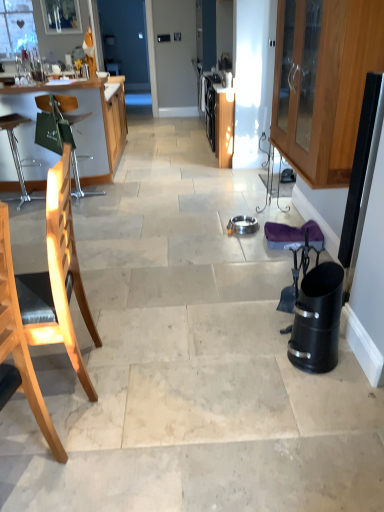
The height and width of the screenshot is (512, 384). What do you see at coordinates (323, 82) in the screenshot?
I see `wooden cabinet at right` at bounding box center [323, 82].

The image size is (384, 512). What do you see at coordinates (59, 131) in the screenshot?
I see `wooden chair at left, which is counted as the first chair, starting from the back` at bounding box center [59, 131].

In order to face transparent glass screen door at upper center, should I rotate leftwards or rightwards?

You should rotate left by 8.874 degrees.

What do you see at coordinates (317, 319) in the screenshot? I see `black plastic trash can at right` at bounding box center [317, 319].

The height and width of the screenshot is (512, 384). What are the coordinates of `light wood chair at left, the second chair positioned from the front` in the screenshot? It's located at (57, 279).

At what (x,y) coordinates should I click in order to perform the action: click on matte glass window screen at upper left. Please return your answer as a coordinate pair (x, y). This screenshot has width=384, height=512. Looking at the image, I should click on (61, 16).

Find the location of `light wood chair at left, which is the third chair from back to front`. light wood chair at left, which is the third chair from back to front is located at coordinates coord(19,346).

In order to face black plastic swivel chair at right, should I rotate leftwards or rightwards?

It's best to rotate right around 14.326 degrees.

Where is `wooden cabinet at right`? wooden cabinet at right is located at coordinates (323, 82).

Who is taller, light wood chair at left, the 1th chair when ordered from front to back, or transparent glass screen door at upper center?

Standing taller between the two is transparent glass screen door at upper center.

From a real-world perspective, is light wood chair at left, which is the third chair from back to front, under transparent glass screen door at upper center?

Yes, from a real-world perspective, light wood chair at left, which is the third chair from back to front, is below transparent glass screen door at upper center.

Is light wood chair at left, which is the third chair from back to front, facing towards transparent glass screen door at upper center?

No.

In the image, is wooden chair at left, which is counted as the first chair, starting from the back, on the left side or the right side of light wood chair at left, the 1th chair when ordered from front to back?

Clearly, wooden chair at left, which is counted as the first chair, starting from the back, is on the left of light wood chair at left, the 1th chair when ordered from front to back, in the image.

Are wooden chair at left, which is counted as the first chair, starting from the back, and light wood chair at left, which is the third chair from back to front, located far from each other?

Yes, wooden chair at left, which is counted as the first chair, starting from the back, is far from light wood chair at left, which is the third chair from back to front.

From a real-world perspective, is wooden chair at left, positioned as the third chair in front-to-back order, positioned above or below light wood chair at left, which is the third chair from back to front?

wooden chair at left, positioned as the third chair in front-to-back order, is situated lower than light wood chair at left, which is the third chair from back to front, in the real world.

Which object is thinner, wooden chair at left, which is counted as the first chair, starting from the back, or light wood chair at left, which is the third chair from back to front?

light wood chair at left, which is the third chair from back to front, is thinner.

Who is smaller, wooden chair at left, positioned as the third chair in front-to-back order, or black plastic swivel chair at right?

Smaller between the two is black plastic swivel chair at right.

Does point (40, 130) come farther from viewer compared to point (307, 262)?

Yes, it is.

From a real-world perspective, is wooden chair at left, positioned as the third chair in front-to-back order, below black plastic swivel chair at right?

No.

Is point (293, 44) closer or farther from the camera than point (88, 168)?

Point (293, 44) appears to be closer to the viewer than point (88, 168).

In the scene shown: Is wooden cabinet at right at the right side of green fabric bag at left?

Yes.

Is wooden cabinet at right positioned far away from green fabric bag at left?

Yes, wooden cabinet at right is far from green fabric bag at left.

Who is bigger, wooden cabinet at right or green fabric bag at left?

green fabric bag at left.

Is black plastic swivel chair at right looking in the opposite direction of light wood chair at left, the second chair positioned from the front?

No, light wood chair at left, the second chair positioned from the front, is not at the back of black plastic swivel chair at right.

From the image's perspective, between black plastic swivel chair at right and light wood chair at left, the second chair positioned from the front, who is located below?

black plastic swivel chair at right is shown below in the image.

Would you say light wood chair at left, positioned as the 2th chair in back-to-front order, is part of black plastic swivel chair at right's contents?

Actually, light wood chair at left, positioned as the 2th chair in back-to-front order, is outside black plastic swivel chair at right.

Between black plastic swivel chair at right and transparent glass screen door at upper center, which one has larger size?

With larger size is transparent glass screen door at upper center.

From a real-world perspective, is black plastic swivel chair at right positioned above or below transparent glass screen door at upper center?

From a real-world perspective, black plastic swivel chair at right is physically below transparent glass screen door at upper center.

Is black plastic swivel chair at right spatially inside transparent glass screen door at upper center, or outside of it?

black plastic swivel chair at right cannot be found inside transparent glass screen door at upper center.

Does black plastic swivel chair at right have a lesser height compared to transparent glass screen door at upper center?

Yes.

Looking at this image, is matte glass window screen at upper left spatially inside light wood chair at left, which is the third chair from back to front, or outside of it?

matte glass window screen at upper left is located beyond the bounds of light wood chair at left, which is the third chair from back to front.

Can you see matte glass window screen at upper left touching light wood chair at left, the 1th chair when ordered from front to back?

No, matte glass window screen at upper left is not beside light wood chair at left, the 1th chair when ordered from front to back.

Is matte glass window screen at upper left turned away from light wood chair at left, which is the third chair from back to front?

No, matte glass window screen at upper left is not facing the opposite direction of light wood chair at left, which is the third chair from back to front.

Identify the location of screen door above the light wood chair at left, the 1th chair when ordered from front to back (from the image's perspective). The height and width of the screenshot is (512, 384). (125, 41).

This screenshot has width=384, height=512. Find the location of `chair below the light wood chair at left, the 1th chair when ordered from front to back (from a real-world perspective)`. chair below the light wood chair at left, the 1th chair when ordered from front to back (from a real-world perspective) is located at coordinates (59, 131).

From the image, which object appears to be nearer to black plastic swivel chair at right, light wood chair at left, positioned as the 2th chair in back-to-front order, or wooden chair at left, positioned as the third chair in front-to-back order?

light wood chair at left, positioned as the 2th chair in back-to-front order.

From the picture: From the image, which object appears to be nearer to wooden chair at left, positioned as the third chair in front-to-back order, green fabric bag at left or transparent glass screen door at upper center?

green fabric bag at left is positioned closer to the anchor wooden chair at left, positioned as the third chair in front-to-back order.

When comparing their distances from light wood chair at left, positioned as the 2th chair in back-to-front order, does light wood chair at left, the 1th chair when ordered from front to back, or black plastic swivel chair at right seem further?

black plastic swivel chair at right.

In the scene shown: Based on their spatial positions, is transparent glass screen door at upper center or wooden cabinet at right closer to green fabric bag at left?

wooden cabinet at right is closer to green fabric bag at left.

From the image, which object appears to be nearer to light wood chair at left, the second chair positioned from the front, transparent glass screen door at upper center or light wood chair at left, which is the third chair from back to front?

Among the two, light wood chair at left, which is the third chair from back to front, is located nearer to light wood chair at left, the second chair positioned from the front.

From the image, which object appears to be nearer to black plastic trash can at right, light wood chair at left, the 1th chair when ordered from front to back, or green fabric bag at left?

light wood chair at left, the 1th chair when ordered from front to back, is positioned closer to the anchor black plastic trash can at right.

Based on their spatial positions, is wooden chair at left, positioned as the third chair in front-to-back order, or black plastic swivel chair at right closer to light wood chair at left, the second chair positioned from the front?

The object closer to light wood chair at left, the second chair positioned from the front, is black plastic swivel chair at right.

Based on their spatial positions, is light wood chair at left, the 1th chair when ordered from front to back, or transparent glass screen door at upper center closer to green fabric bag at left?

Based on the image, light wood chair at left, the 1th chair when ordered from front to back, appears to be nearer to green fabric bag at left.

You are a GUI agent. You are given a task and a screenshot of the screen. Output one action in this format:
    pyautogui.click(x=<x>, y=<y>)
    Task: Click on the swivel chair situated between green fabric bag at left and black plastic trash can at right from left to right
    
    Given the screenshot: What is the action you would take?
    pyautogui.click(x=301, y=262)

Identify the location of table between light wood chair at left, the 1th chair when ordered from front to back, and matte glass window screen at upper left, along the z-axis. (74, 129).

Image resolution: width=384 pixels, height=512 pixels. In order to click on swivel chair situated between wooden chair at left, positioned as the third chair in front-to-back order, and wooden cabinet at right from left to right in this screenshot , I will do `click(301, 262)`.

Identify the location of window screen positioned between black plastic trash can at right and transparent glass screen door at upper center from near to far. (61, 16).